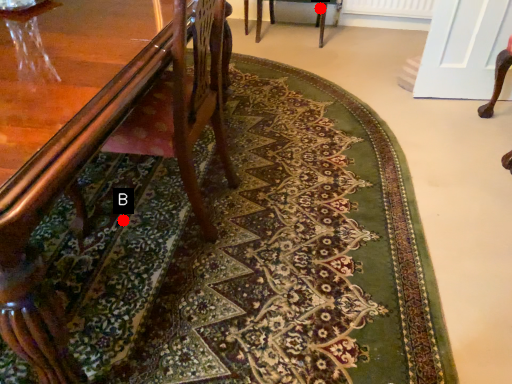
Question: Two points are circled on the image, labeled by A and B beside each circle. Which point is closer to the camera?

Choices:
 (A) A is closer
 (B) B is closer

Answer: (B)